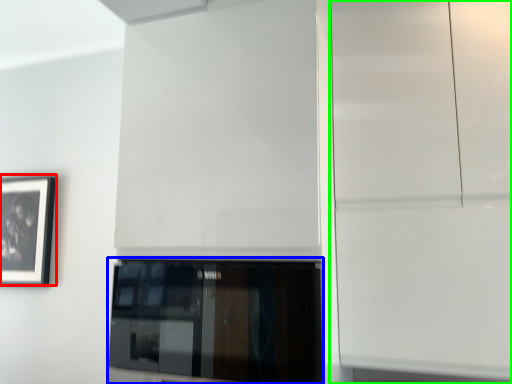
Question: Which is nearer to the picture frame (highlighted by a red box)? window (highlighted by a blue box) or glass door (highlighted by a green box).

Choices:
 (A) window
 (B) glass door

Answer: (A)